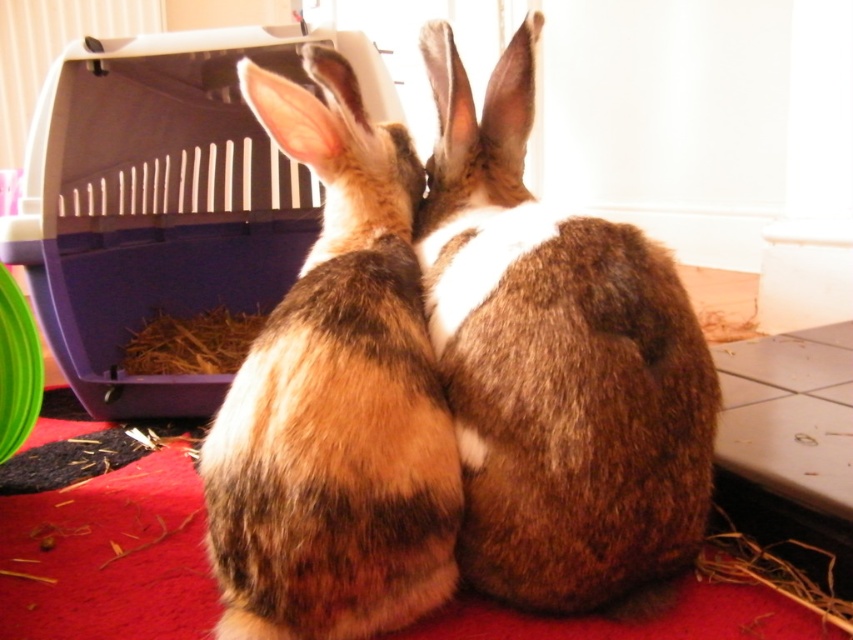
You are a veterinarian trying to determine if two rabbits can be placed in a single cage. You observe the brown furry rabbit at center and the brown fuzzy rabbit at center. Given their proximity, can they be safely housed together in a cage that requires at least 6 inches of space between them?

The brown furry rabbit at center and the brown fuzzy rabbit at center are only 4.06 inches apart, which is less than the required 6 inches of space. Therefore, they cannot be safely housed together in the cage as they are too close.

Based on the photo, you are a veterinarian examining two rabbits in an enclosure. You notice the brown furry rabbit at center and the brown fuzzy rabbit at center. Which rabbit is sitting on top of the other?

The brown furry rabbit at center is sitting on top of the brown fuzzy rabbit at center.

You are a veterinarian observing two rabbits in an examination room. You notice the brown furry rabbit at center and the brown fuzzy rabbit at center. Which rabbit is closer to you?

The brown furry rabbit at center is closer to you because it is further to the viewer than the brown fuzzy rabbit at center.